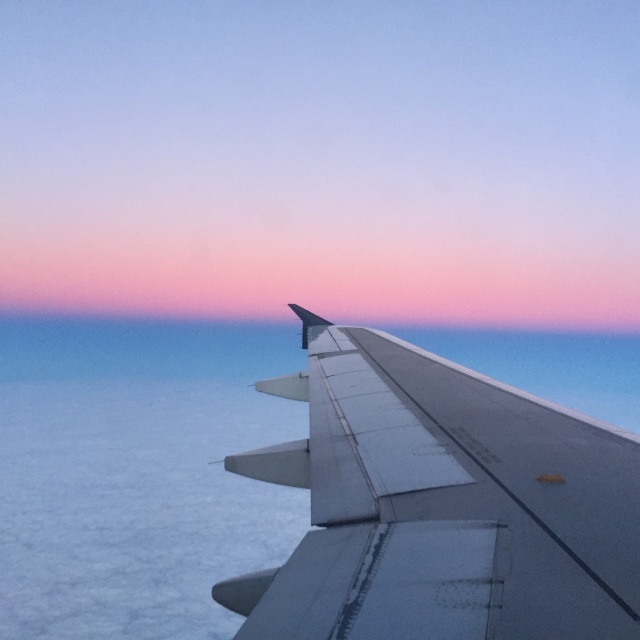
Which of these two, matte white wing at center or metallic gray wing at right, stands taller?

matte white wing at center

Find the location of a particular element. The width and height of the screenshot is (640, 640). matte white wing at center is located at coordinates (323, 160).